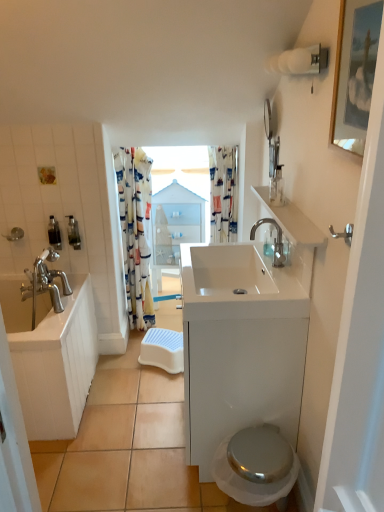
Identify the location of free point above white glossy sink at upper right (from a real-world perspective). (291, 208).